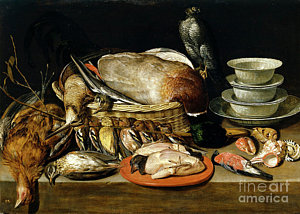
Identify the location of plate. This screenshot has height=214, width=300. (187, 176).